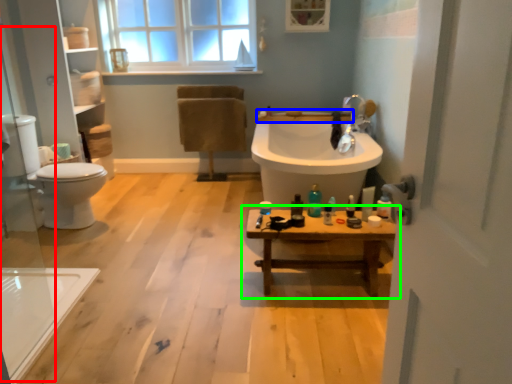
Question: Which object is the closest to the glass door (highlighted by a red box)? Choose among these: counter top (highlighted by a blue box) or table (highlighted by a green box).

Choices:
 (A) counter top
 (B) table

Answer: (B)